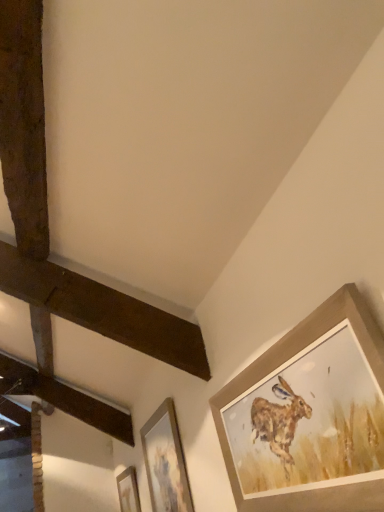
Question: Which direction should I rotate to face wooden picture frame at center, the second picture frame when ordered from top to bottom, — up or down?

Choices:
 (A) down
 (B) up

Answer: (A)

Question: Is wooden picture frame at lower center, the third picture frame when ordered from front to back, positioned behind wooden picture frame at upper right, which is the 3th picture frame from bottom to top?

Choices:
 (A) no
 (B) yes

Answer: (B)

Question: Is wooden picture frame at lower center, placed as the first picture frame when sorted from bottom to top, positioned before wooden picture frame at upper right, acting as the first picture frame starting from the right?

Choices:
 (A) no
 (B) yes

Answer: (A)

Question: From the image's perspective, would you say wooden picture frame at lower center, the third picture frame when ordered from front to back, is shown under wooden picture frame at upper right, acting as the 1th picture frame starting from the front?

Choices:
 (A) yes
 (B) no

Answer: (A)

Question: From a real-world perspective, is wooden picture frame at lower center, positioned as the third picture frame in top-to-bottom order, on wooden picture frame at upper right, acting as the first picture frame starting from the right?

Choices:
 (A) yes
 (B) no

Answer: (A)

Question: From the image's perspective, does wooden picture frame at lower center, the 3th picture frame viewed from the right, appear higher than wooden picture frame at upper right, the third picture frame positioned from the left?

Choices:
 (A) no
 (B) yes

Answer: (A)

Question: Can you confirm if wooden picture frame at lower center, the third picture frame when ordered from front to back, is bigger than wooden picture frame at upper right, marked as the 3th picture frame in a back-to-front arrangement?

Choices:
 (A) no
 (B) yes

Answer: (A)

Question: From the image's perspective, is wooden picture frame at center, placed as the second picture frame when sorted from left to right, above wooden picture frame at lower center, positioned as the third picture frame in top-to-bottom order?

Choices:
 (A) no
 (B) yes

Answer: (B)

Question: Is wooden picture frame at center, the 2th picture frame viewed from the back, facing towards wooden picture frame at lower center, placed as the first picture frame when sorted from bottom to top?

Choices:
 (A) yes
 (B) no

Answer: (B)

Question: From the image's perspective, is wooden picture frame at center, placed as the second picture frame when sorted from left to right, below wooden picture frame at lower center, positioned as the third picture frame in top-to-bottom order?

Choices:
 (A) yes
 (B) no

Answer: (B)

Question: Is wooden picture frame at center, which appears as the 2th picture frame when viewed from the front, touching wooden picture frame at lower center, the third picture frame when ordered from front to back?

Choices:
 (A) no
 (B) yes

Answer: (A)

Question: Is wooden picture frame at center, placed as the second picture frame when sorted from left to right, far from wooden picture frame at lower center, placed as the first picture frame when sorted from bottom to top?

Choices:
 (A) yes
 (B) no

Answer: (A)

Question: Can you confirm if wooden picture frame at center, the 2th picture frame in the bottom-to-top sequence, is taller than wooden picture frame at lower center, placed as the first picture frame when sorted from bottom to top?

Choices:
 (A) no
 (B) yes

Answer: (B)

Question: Is wooden picture frame at lower center, placed as the first picture frame when sorted from bottom to top, positioned behind wooden picture frame at center, which appears as the 2th picture frame when viewed from the front?

Choices:
 (A) yes
 (B) no

Answer: (A)